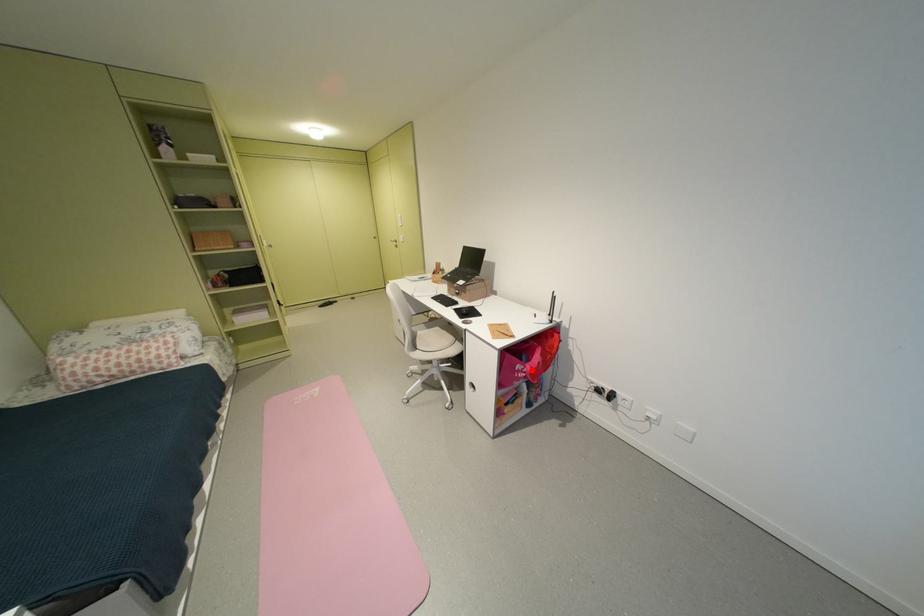
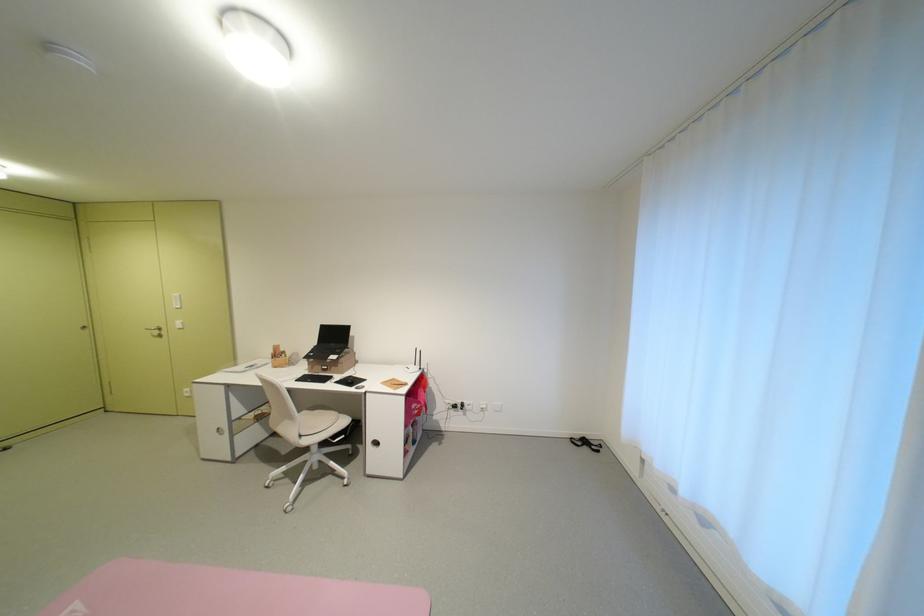
Question: A red point is marked in image1. In image2, is the corresponding 3D point closer to the camera or farther? Reply with the corresponding letter.

Choices:
 (A) The corresponding 3D point is closer.
 (B) The corresponding 3D point is farther.

Answer: (A)